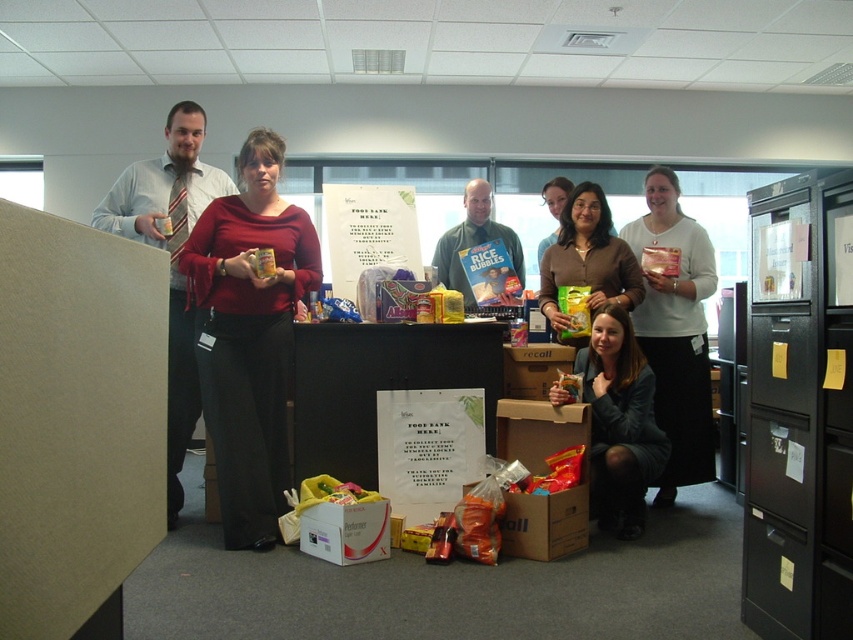
Which is behind, point (329, 332) or point (184, 381)?

The point (329, 332) is more distant.

Who is shorter, cardboard sign at center or matte tie at left?

Standing shorter between the two is cardboard sign at center.

Between point (369, 476) and point (184, 116), which one is positioned in front?

Point (184, 116) is in front.

At what (x,y) coordinates should I click in order to perform the action: click on cardboard sign at center. Please return your answer as a coordinate pair (x, y). Image resolution: width=853 pixels, height=640 pixels. Looking at the image, I should click on (379, 385).

Can you confirm if matte black jacket at lower center is positioned to the left of matte brown hair at center?

In fact, matte black jacket at lower center is to the right of matte brown hair at center.

Based on the photo, how far apart are matte black jacket at lower center and matte brown hair at center?

They are 3.99 feet apart.

Which is in front, point (628, 502) or point (541, 195)?

Positioned in front is point (628, 502).

Where is `matte black jacket at lower center`? matte black jacket at lower center is located at coordinates (619, 422).

Is cardboard sign at center thinner than matte white shirt at center?

In fact, cardboard sign at center might be wider than matte white shirt at center.

Which is in front, point (347, 346) or point (677, 284)?

Point (347, 346) is in front.

Image resolution: width=853 pixels, height=640 pixels. Identify the location of cardboard sign at center. tap(379, 385).